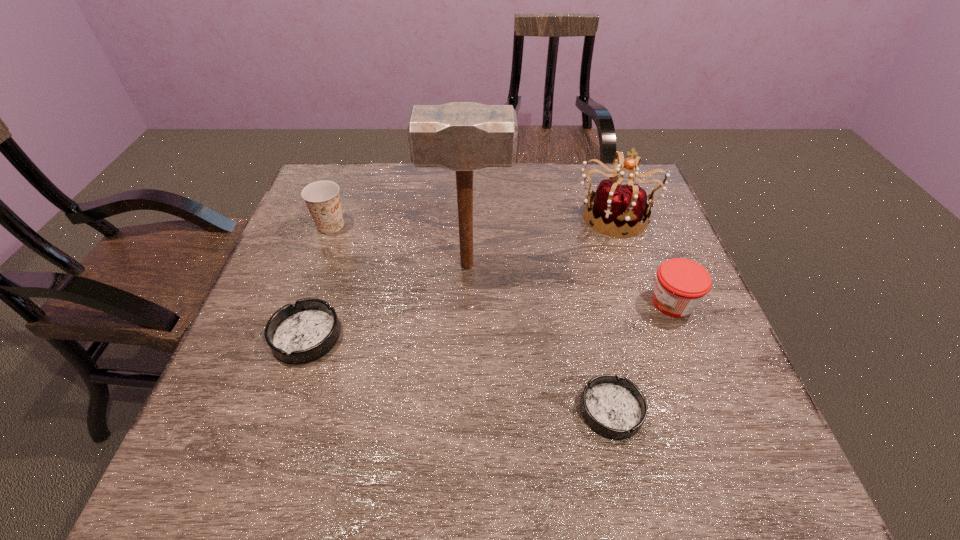
Find the location of a particular element. This screenshot has width=960, height=540. vacant space located 0.200m on the back of the shortest object is located at coordinates 588,307.

At what (x,y) coordinates should I click in order to perform the action: click on vacant area located on the striking face of the mallet. Please return your answer as a coordinate pair (x, y). The width and height of the screenshot is (960, 540). Looking at the image, I should click on (630, 266).

Locate an element on the screen. This screenshot has width=960, height=540. vacant space situated 0.170m on the front-facing side of the fifth shortest object is located at coordinates (638, 287).

This screenshot has height=540, width=960. I want to click on free space located 0.070m on the right of the fourth shortest object, so click(x=372, y=225).

Identify the location of vacant area situated 0.100m on the label side of the fourth tallest object. Image resolution: width=960 pixels, height=540 pixels. (606, 302).

Locate an element on the screen. This screenshot has width=960, height=540. vacant space located 0.340m on the label side of the fourth tallest object is located at coordinates (503, 302).

This screenshot has height=540, width=960. What are the coordinates of `vacant space located 0.080m on the label side of the fourth tallest object` in the screenshot? It's located at (614, 302).

This screenshot has width=960, height=540. Identify the location of object that is at the far edge. (619, 205).

The image size is (960, 540). Identify the location of object present at the near edge. (616, 408).

Find the location of `ashtray that is at the left edge`. ashtray that is at the left edge is located at coordinates (303, 332).